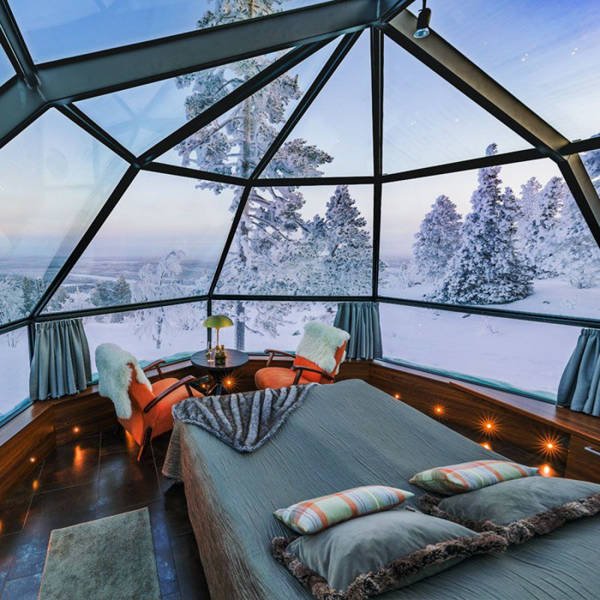
Identify the location of orange chair. (277, 360).